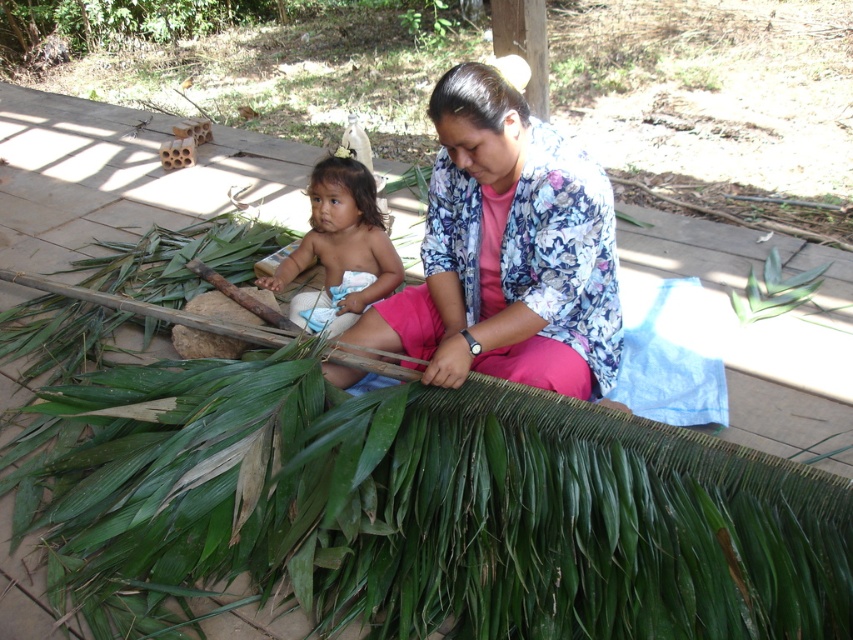
You are standing at the point with coordinates point (508, 252). What object is located exactly at your current position in the scene?

The point (508, 252) corresponds to the floral patterned fabric at center.

You are standing at the point labeled as point (811, 280) and want to move towards the point labeled as point (335, 189). Which direction should you face to walk directly towards it?

To move from point (811, 280) to point (335, 189), you should face north because point (335, 189) is in front of point (811, 280).